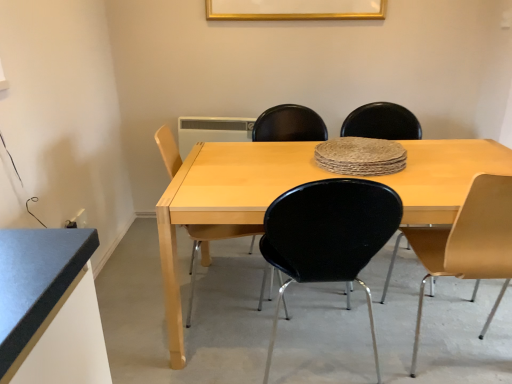
This screenshot has height=384, width=512. I want to click on vacant space to the left of matte yellow chair at right, placed as the first chair when sorted from right to left, so click(365, 329).